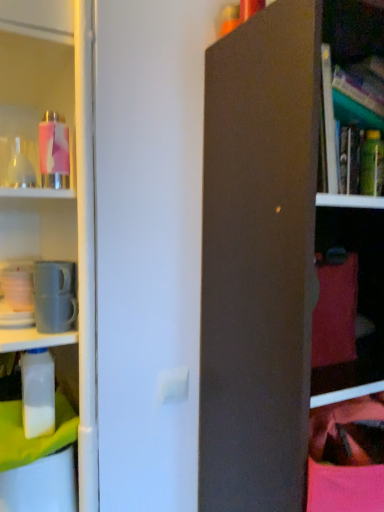
Question: Does translucent glass bottle at upper left, the first bottle viewed from the left, have a greater height compared to green matte bottle at upper right, the 4th bottle from the left?

Choices:
 (A) yes
 (B) no

Answer: (B)

Question: Considering the relative positions of translucent glass bottle at upper left, the third bottle positioned from the top, and green matte bottle at upper right, the third bottle from the bottom, in the image provided, is translucent glass bottle at upper left, the third bottle positioned from the top, in front of green matte bottle at upper right, the third bottle from the bottom,?

Choices:
 (A) no
 (B) yes

Answer: (B)

Question: Considering the relative sizes of translucent glass bottle at upper left, the first bottle viewed from the left, and green matte bottle at upper right, the third bottle from the bottom, in the image provided, is translucent glass bottle at upper left, the first bottle viewed from the left, bigger than green matte bottle at upper right, the third bottle from the bottom,?

Choices:
 (A) no
 (B) yes

Answer: (A)

Question: Is translucent glass bottle at upper left, the first bottle viewed from the left, smaller than green matte bottle at upper right, the 1th bottle viewed from the right?

Choices:
 (A) no
 (B) yes

Answer: (B)

Question: Does translucent glass bottle at upper left, the first bottle viewed from the left, have a greater width compared to green matte bottle at upper right, the second bottle from the top?

Choices:
 (A) yes
 (B) no

Answer: (A)

Question: Is translucent glass bottle at upper left, marked as the second bottle in a bottom-to-top arrangement, next to green matte bottle at upper right, the 1th bottle viewed from the right, and touching it?

Choices:
 (A) no
 (B) yes

Answer: (A)

Question: Can you confirm if white plastic bottle at left, which is the 3th bottle from right to left, is smaller than pink matte water bottle at upper left, the 2th bottle in the right-to-left sequence?

Choices:
 (A) no
 (B) yes

Answer: (A)

Question: Is white plastic bottle at left, which appears as the 2th bottle when viewed from the left, aimed at pink matte water bottle at upper left, the third bottle in the left-to-right sequence?

Choices:
 (A) no
 (B) yes

Answer: (A)

Question: Considering the relative sizes of white plastic bottle at left, which is the 3th bottle from right to left, and pink matte water bottle at upper left, which ranks as the fourth bottle in bottom-to-top order, in the image provided, is white plastic bottle at left, which is the 3th bottle from right to left, thinner than pink matte water bottle at upper left, which ranks as the fourth bottle in bottom-to-top order,?

Choices:
 (A) yes
 (B) no

Answer: (B)

Question: Is white plastic bottle at left, which is the 3th bottle from right to left, outside pink matte water bottle at upper left, marked as the 1th bottle in a top-to-bottom arrangement?

Choices:
 (A) yes
 (B) no

Answer: (A)

Question: From the image's perspective, is white plastic bottle at left, which appears as the 2th bottle when viewed from the left, located above pink matte water bottle at upper left, marked as the 1th bottle in a top-to-bottom arrangement?

Choices:
 (A) yes
 (B) no

Answer: (B)

Question: Can you confirm if white plastic bottle at left, the 1th bottle in the bottom-to-top sequence, is bigger than pink matte water bottle at upper left, the third bottle in the left-to-right sequence?

Choices:
 (A) no
 (B) yes

Answer: (B)

Question: From the image's perspective, is translucent glass bottle at upper left, marked as the second bottle in a bottom-to-top arrangement, on top of pink matte water bottle at upper left, the third bottle in the left-to-right sequence?

Choices:
 (A) yes
 (B) no

Answer: (B)